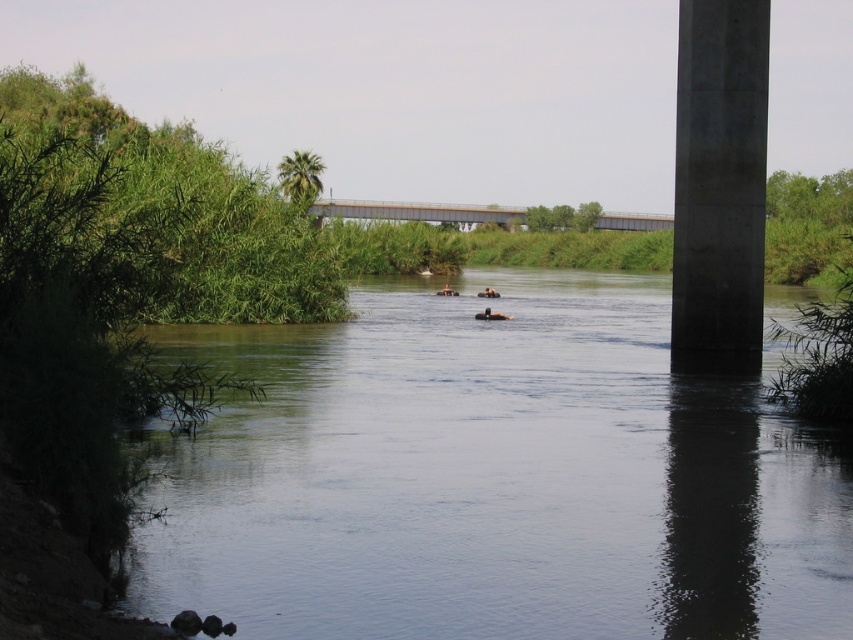
Is clear water at center thinner than metal/textured bridge at upper center?

Indeed, clear water at center has a lesser width compared to metal/textured bridge at upper center.

Who is positioned more to the right, clear water at center or metal/textured bridge at upper center?

Positioned to the right is clear water at center.

Does point (451, 490) lie in front of point (665, 225)?

Yes.

At what (x,y) coordinates should I click in order to perform the action: click on clear water at center. Please return your answer as a coordinate pair (x, y). Looking at the image, I should click on (492, 477).

Between point (724, 204) and point (625, 225), which one is positioned behind?

Positioned behind is point (625, 225).

Is the position of concrete at right more distant than that of metal/textured bridge at upper center?

That is False.

Locate an element on the screen. concrete at right is located at coordinates (718, 186).

Can you confirm if metal/textured bridge at upper center is smaller than brown rubber ring at center?

Actually, metal/textured bridge at upper center might be larger than brown rubber ring at center.

Where is `metal/textured bridge at upper center`? This screenshot has height=640, width=853. metal/textured bridge at upper center is located at coordinates (416, 211).